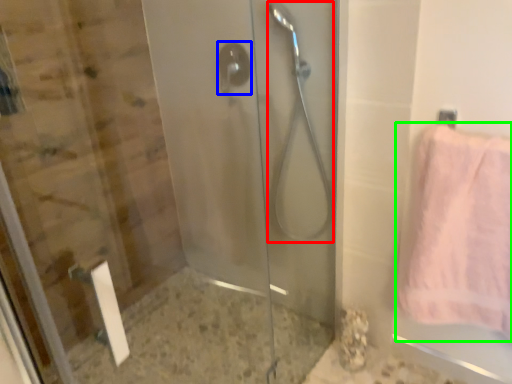
Question: Which is nearer to the shower (highlighted by a red box)? shower (highlighted by a blue box) or towel (highlighted by a green box).

Choices:
 (A) shower
 (B) towel

Answer: (A)